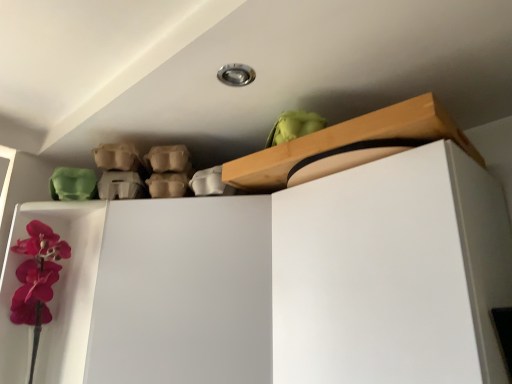
Where is `wooden at upper center`? wooden at upper center is located at coordinates (348, 141).

This screenshot has width=512, height=384. What do you see at coordinates (348, 141) in the screenshot? I see `wooden at upper center` at bounding box center [348, 141].

What do you see at coordinates (288, 281) in the screenshot? This screenshot has height=384, width=512. I see `white matte dresser at upper center` at bounding box center [288, 281].

Image resolution: width=512 pixels, height=384 pixels. I want to click on white matte dresser at upper center, so click(288, 281).

Where is `wooden at upper center`? wooden at upper center is located at coordinates (348, 141).

Consider the image. Is white matte dresser at upper center at the left side of wooden at upper center?

Yes.

Is white matte dresser at upper center positioned before wooden at upper center?

Yes.

Does point (274, 361) come farther from viewer compared to point (432, 105)?

Yes, it is behind point (432, 105).

From the image's perspective, between white matte dresser at upper center and wooden at upper center, which one is located above?

wooden at upper center is shown above in the image.

From a real-world perspective, is white matte dresser at upper center located beneath wooden at upper center?

Correct, in the physical world, white matte dresser at upper center is lower than wooden at upper center.

Between white matte dresser at upper center and wooden at upper center, which one has smaller width?

Thinner between the two is wooden at upper center.

Is white matte dresser at upper center taller than wooden at upper center?

Indeed, white matte dresser at upper center has a greater height compared to wooden at upper center.

Who is bigger, white matte dresser at upper center or wooden at upper center?

white matte dresser at upper center.

Does white matte dresser at upper center contain wooden at upper center?

No, wooden at upper center is not inside white matte dresser at upper center.

Looking at this image, is white matte dresser at upper center beside wooden at upper center?

No, white matte dresser at upper center is not beside wooden at upper center.

Could you tell me if white matte dresser at upper center is turned towards wooden at upper center?

No, white matte dresser at upper center is not oriented towards wooden at upper center.

In the scene shown: How far apart are white matte dresser at upper center and wooden at upper center?

8.38 inches.

You are a GUI agent. You are given a task and a screenshot of the screen. Output one action in this format:
    pyautogui.click(x=<x>, y=<y>)
    Task: Click on the dresser below the wooden at upper center (from the image's perspective)
    This screenshot has width=512, height=384.
    Given the screenshot: What is the action you would take?
    pyautogui.click(x=288, y=281)

Does wooden at upper center appear on the left side of white matte dresser at upper center?

No.

Is wooden at upper center in front of or behind white matte dresser at upper center in the image?

wooden at upper center is positioned farther from the viewer than white matte dresser at upper center.

Which point is more distant from viewer, (462,141) or (323,341)?

The point (462,141) is farther.

From the image's perspective, would you say wooden at upper center is shown under white matte dresser at upper center?

No, from the image's perspective, wooden at upper center is not below white matte dresser at upper center.

From a real-world perspective, between wooden at upper center and white matte dresser at upper center, who is vertically lower?

white matte dresser at upper center.

Does wooden at upper center have a lesser width compared to white matte dresser at upper center?

Correct, the width of wooden at upper center is less than that of white matte dresser at upper center.

Considering the sizes of wooden at upper center and white matte dresser at upper center in the image, is wooden at upper center taller or shorter than white matte dresser at upper center?

wooden at upper center is shorter than white matte dresser at upper center.

Does wooden at upper center have a smaller size compared to white matte dresser at upper center?

Correct, wooden at upper center occupies less space than white matte dresser at upper center.

Is white matte dresser at upper center located within wooden at upper center?

No, white matte dresser at upper center is not inside wooden at upper center.

Is wooden at upper center not close to white matte dresser at upper center?

No, wooden at upper center is in close proximity to white matte dresser at upper center.

Could you tell me if wooden at upper center is facing white matte dresser at upper center?

No, wooden at upper center is not turned towards white matte dresser at upper center.

Identify the location of shelf located on the right of white matte dresser at upper center. Image resolution: width=512 pixels, height=384 pixels. (348, 141).

Identify the location of shelf above the white matte dresser at upper center (from the image's perspective). (348, 141).

The height and width of the screenshot is (384, 512). Identify the location of shelf above the white matte dresser at upper center (from a real-world perspective). (348, 141).